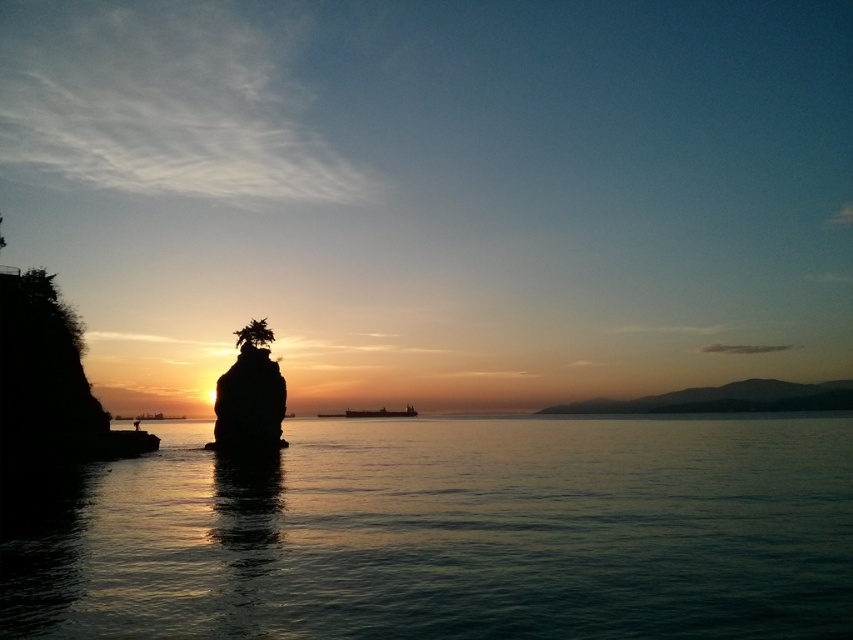
Question: Which point is closer to the camera taking this photo?

Choices:
 (A) (386, 413)
 (B) (250, 352)
 (C) (113, 618)

Answer: (C)

Question: Does transparent water at center have a greater width compared to metallic gray ship at center?

Choices:
 (A) yes
 (B) no

Answer: (A)

Question: Does transparent water at center have a greater width compared to silhouette stone at center?

Choices:
 (A) yes
 (B) no

Answer: (A)

Question: Among these objects, which one is farthest from the camera?

Choices:
 (A) metallic gray ship at center
 (B) transparent water at center

Answer: (A)

Question: Where is transparent water at center located in relation to metallic gray ship at center in the image?

Choices:
 (A) below
 (B) above

Answer: (B)

Question: Based on their relative distances, which object is nearer to the silhouette stone at center?

Choices:
 (A) metallic gray ship at center
 (B) transparent water at center

Answer: (B)